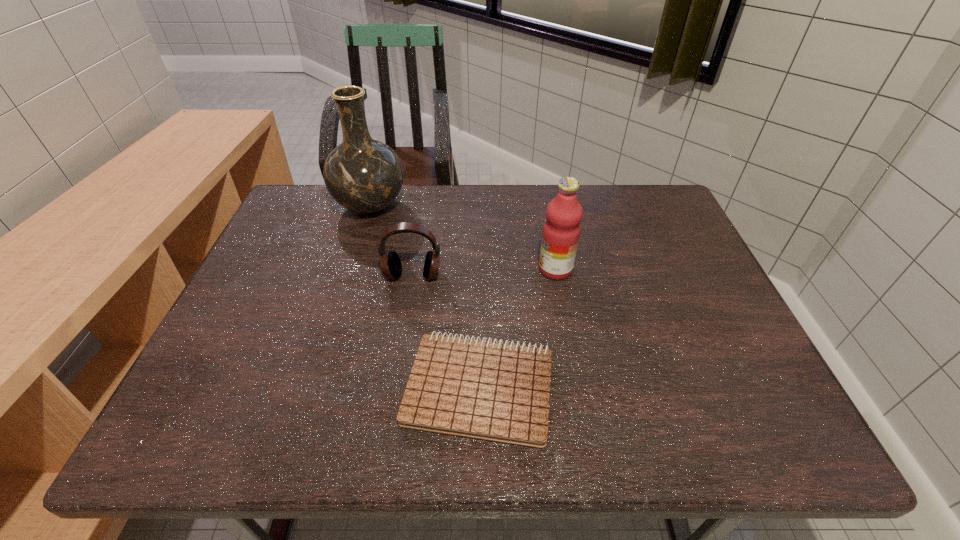
Select which object is the third closest to the rightmost object. Please provide its 2D coordinates. Your answer should be formatted as a tuple, i.e. [(x, y)], where the tuple contains the x and y coordinates of a point satisfying the conditions above.

[(364, 175)]

I want to click on object that can be found as the second closest to the notebook, so click(x=561, y=231).

Find the location of a particular element. The image size is (960, 540). blank area in the image that satisfies the following two spatial constraints: 1. on the ear pads of the shortest object; 2. on the right side of the third tallest object is located at coordinates (396, 387).

Where is `vacant point that satisfies the following two spatial constraints: 1. on the ear pads of the shortest object; 2. on the left side of the second shortest object`? The width and height of the screenshot is (960, 540). vacant point that satisfies the following two spatial constraints: 1. on the ear pads of the shortest object; 2. on the left side of the second shortest object is located at coordinates (396, 387).

Find the location of a particular element. This screenshot has height=540, width=960. free space in the image that satisfies the following two spatial constraints: 1. on the ear pads of the nearest object; 2. on the left side of the headset is located at coordinates tap(396, 387).

Where is `free location that satisfies the following two spatial constraints: 1. on the label of the fruit juice; 2. on the ear pads of the second shortest object`? free location that satisfies the following two spatial constraints: 1. on the label of the fruit juice; 2. on the ear pads of the second shortest object is located at coordinates (557, 275).